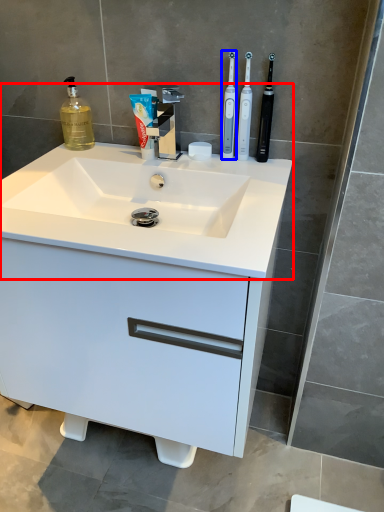
Question: Which of the following is the farthest to the observer, sink (highlighted by a red box) or toothbrush (highlighted by a blue box)?

Choices:
 (A) sink
 (B) toothbrush

Answer: (B)